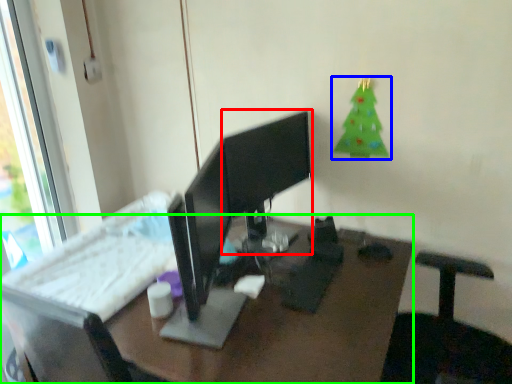
Question: Which is farther away from computer monitor (highlighted by a red box)? christmas tree (highlighted by a blue box) or desk (highlighted by a green box)?

Choices:
 (A) christmas tree
 (B) desk

Answer: (B)